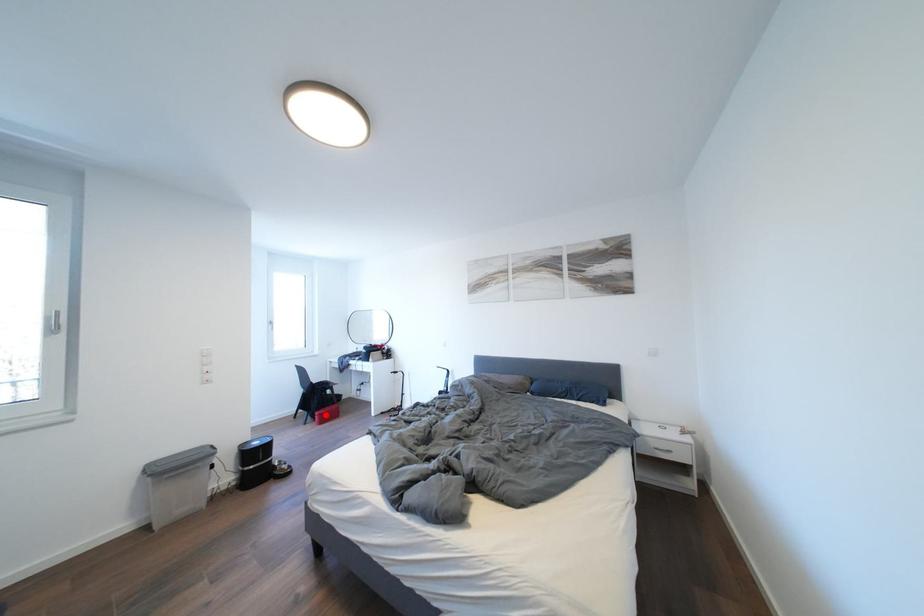
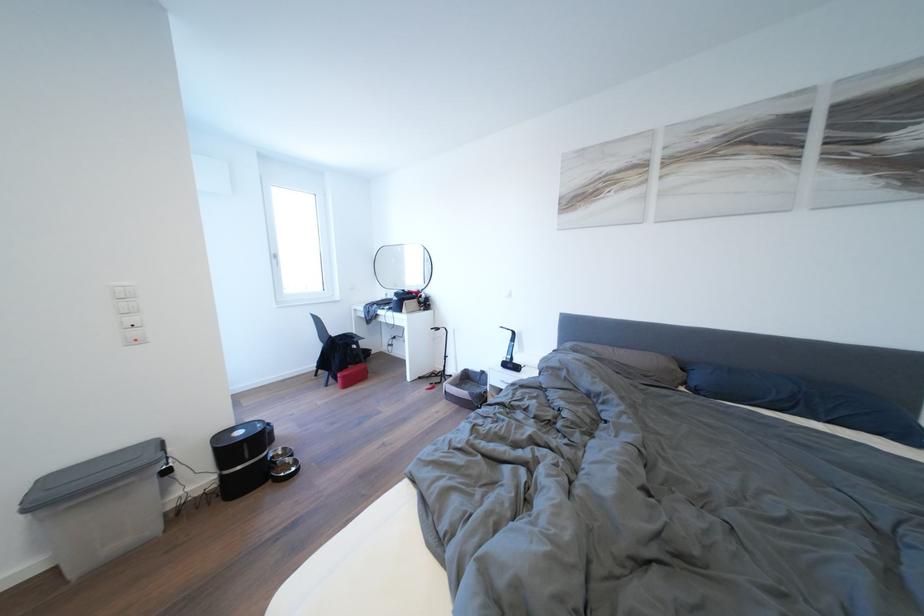
In the second image, find the point that corresponds to the highlighted location in the first image.

(348, 376)